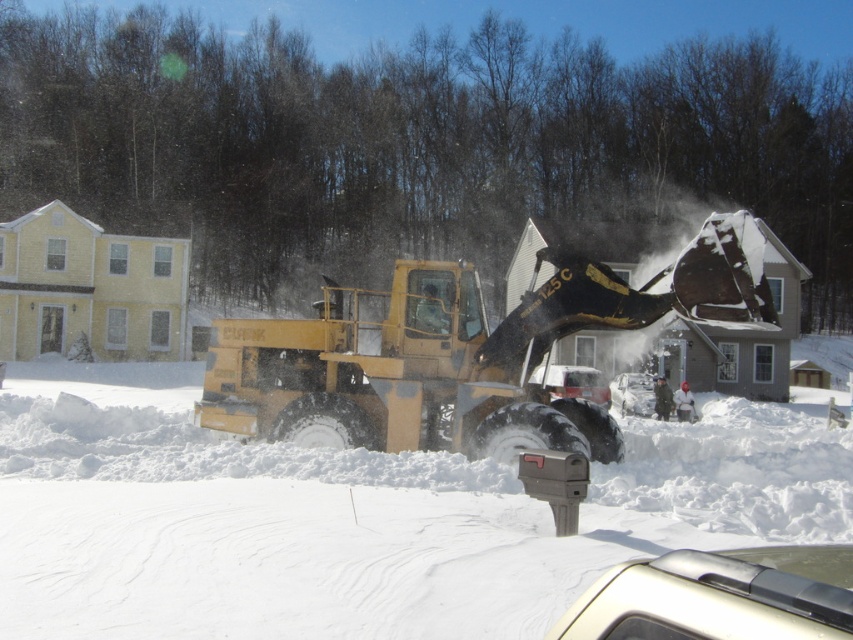
This screenshot has height=640, width=853. What do you see at coordinates (715, 596) in the screenshot? I see `metallic silver car at lower right` at bounding box center [715, 596].

Based on the photo, who is positioned more to the right, metallic silver car at lower right or white matte car at center?

white matte car at center is more to the right.

Describe the element at coordinates (715, 596) in the screenshot. The width and height of the screenshot is (853, 640). I see `metallic silver car at lower right` at that location.

This screenshot has width=853, height=640. What are the coordinates of `metallic silver car at lower right` in the screenshot? It's located at (715, 596).

Is yellow rubber plow at center smaller than metallic silver car at center?

Actually, yellow rubber plow at center might be larger than metallic silver car at center.

Identify the location of yellow rubber plow at center. (461, 353).

Locate an element on the screen. yellow rubber plow at center is located at coordinates tap(461, 353).

Is yellow rubber plow at center above white matte car at center?

Correct, yellow rubber plow at center is located above white matte car at center.

Based on the photo, can you confirm if yellow rubber plow at center is positioned to the right of white matte car at center?

No, yellow rubber plow at center is not to the right of white matte car at center.

The image size is (853, 640). Find the location of `yellow rubber plow at center`. yellow rubber plow at center is located at coordinates (461, 353).